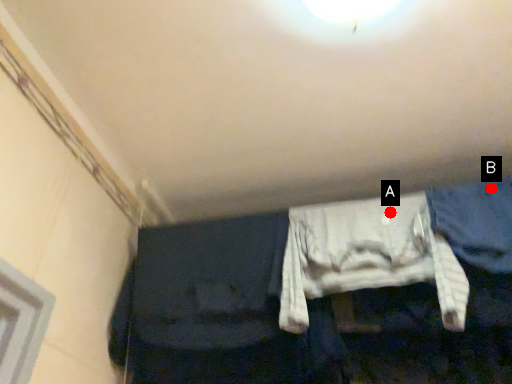
Question: Two points are circled on the image, labeled by A and B beside each circle. Which point is further to the camera?

Choices:
 (A) A is further
 (B) B is further

Answer: (B)